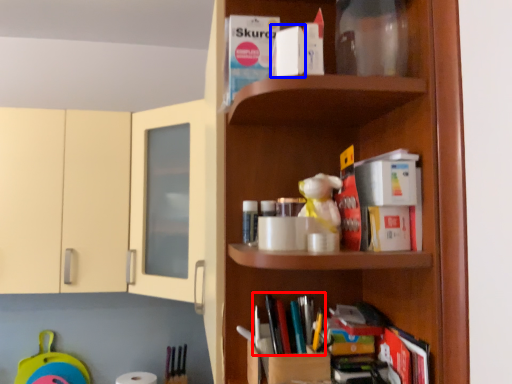
Question: Which object is further to the camera taking this photo, book (highlighted by a red box) or book (highlighted by a blue box)?

Choices:
 (A) book
 (B) book

Answer: (A)